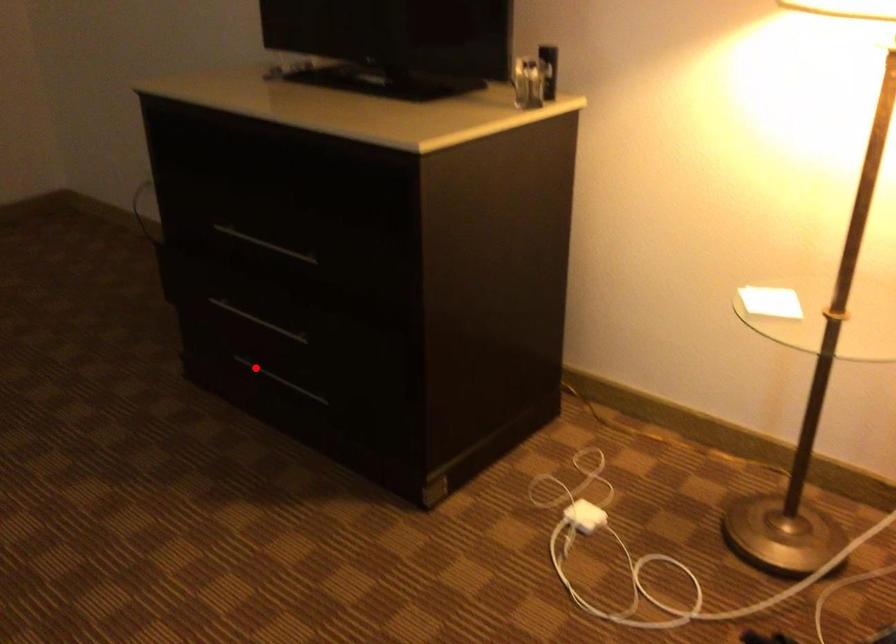
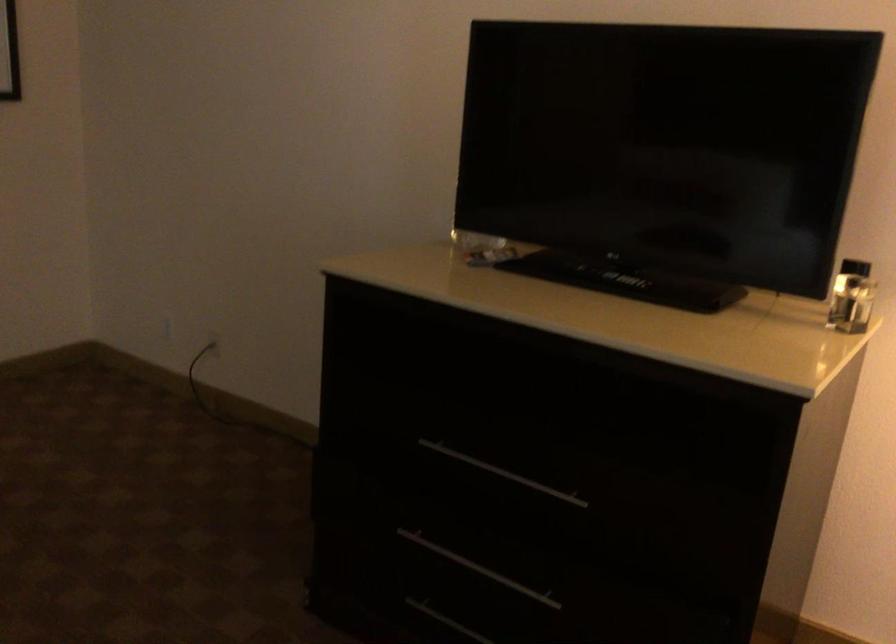
The point at the highlighted location is marked in the first image. Where is the corresponding point in the second image?

(446, 621)